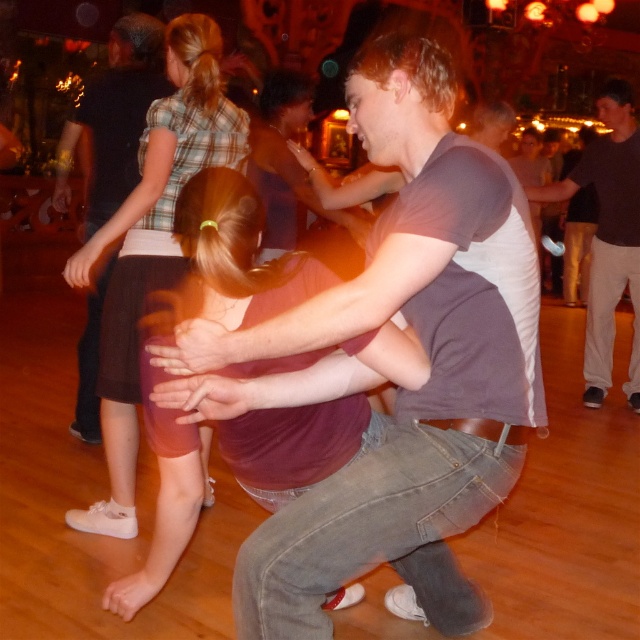
Question: Estimate the real-world distances between objects in this image. Which object is closer to the dark gray shirt at center?

Choices:
 (A) matte gray t-shirt at center
 (B) maroon fabric skirt at lower left
 (C) matte brown shirt at center
 (D) brown skirt at lower left

Answer: (D)

Question: Among these objects, which one is farthest from the camera?

Choices:
 (A) brown skirt at lower left
 (B) matte brown shirt at center
 (C) maroon fabric skirt at lower left
 (D) matte gray t-shirt at center

Answer: (B)

Question: Does matte brown shirt at center appear on the left side of dark gray shirt at center?

Choices:
 (A) yes
 (B) no

Answer: (A)

Question: Which point is closer to the camera?

Choices:
 (A) matte gray t-shirt at center
 (B) brown skirt at lower left

Answer: (A)

Question: Can you confirm if brown skirt at lower left is positioned to the left of dark gray shirt at center?

Choices:
 (A) yes
 (B) no

Answer: (A)

Question: Where is brown skirt at lower left located in relation to dark gray shirt at center in the image?

Choices:
 (A) above
 (B) below

Answer: (B)